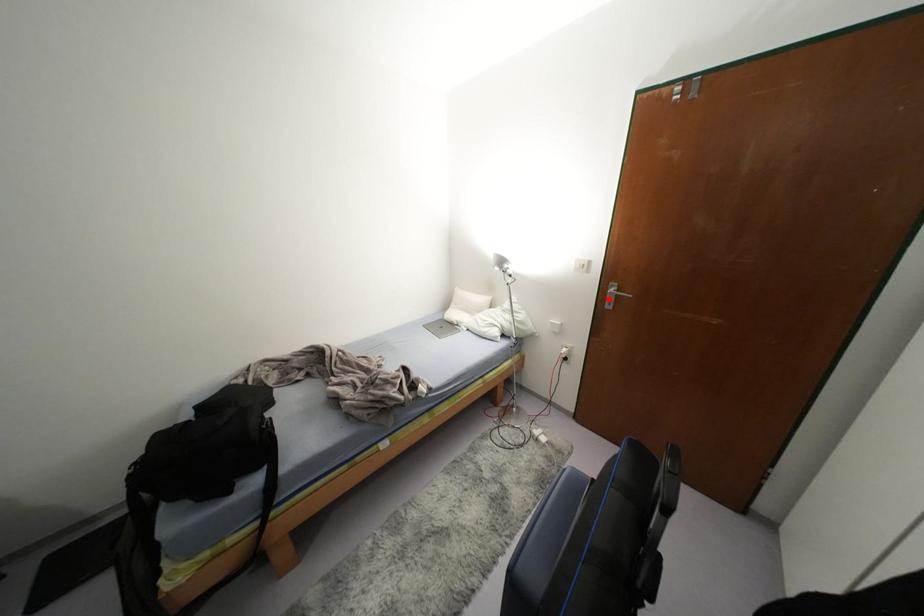
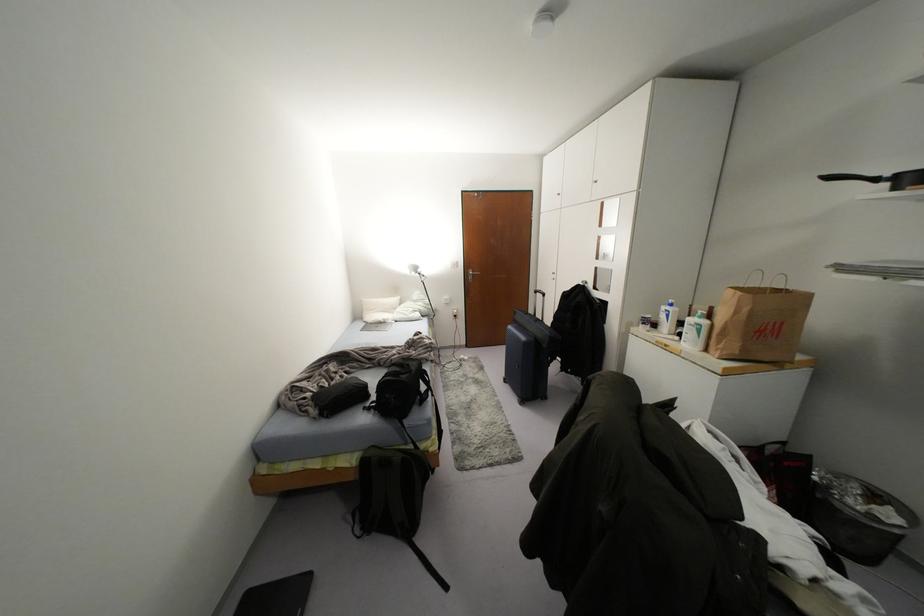
Where in the second image is the point corresponding to the highlighted location from the first image?

(469, 277)